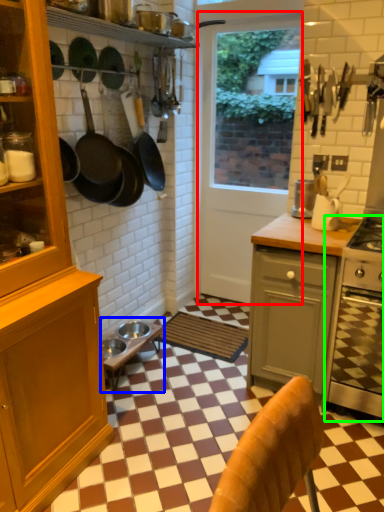
Question: Estimate the real-world distances between objects in this image. Which object is closer to screen door (highlighted by a red box), table (highlighted by a blue box) or oven (highlighted by a green box)?

Choices:
 (A) table
 (B) oven

Answer: (A)